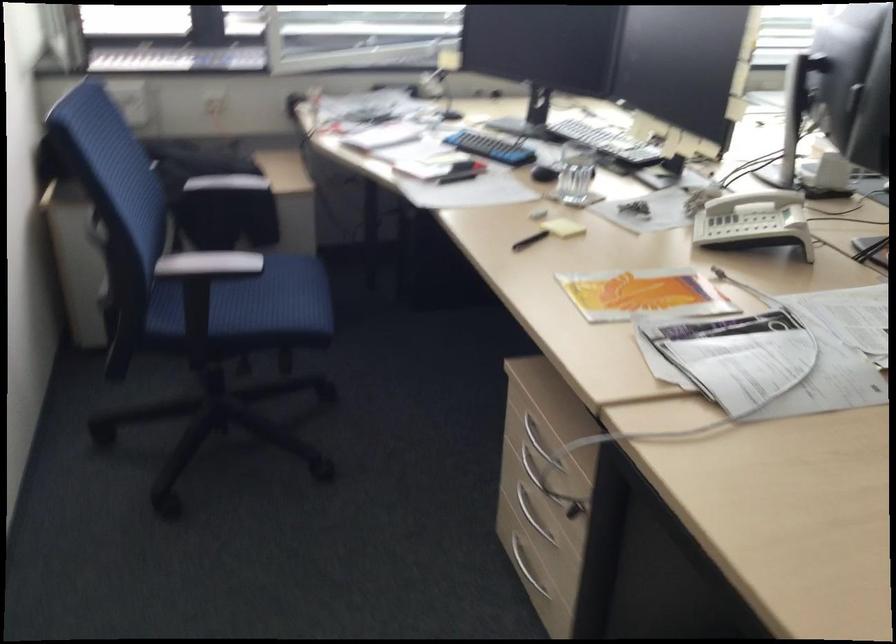
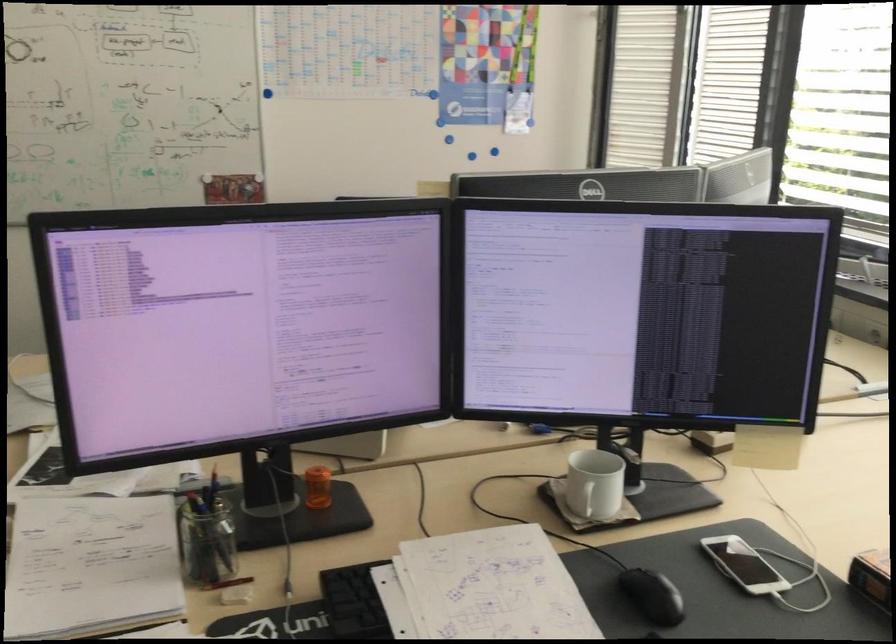
Question: I am providing you with two images of the same scene from different viewpoints. Which of the following objects are not visible in image2?

Choices:
 (A) blue push pin
 (B) black pen
 (C) copier document feeder
 (D) white eraser

Answer: (B)